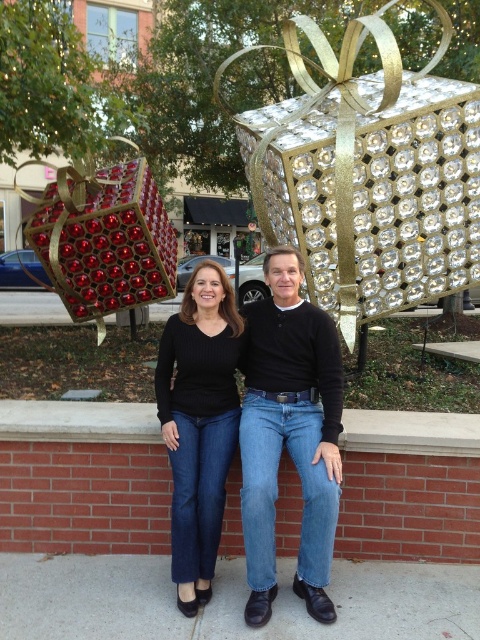
Question: Does shiny red baubles at left have a greater width compared to brick ledge at center?

Choices:
 (A) yes
 (B) no

Answer: (A)

Question: Considering the real-world distances, which object is closest to the black matte jeans at center?

Choices:
 (A) shiny red baubles at left
 (B) black knit sweater at center
 (C) brick ledge at center

Answer: (B)

Question: Which object is positioned closest to the black matte jeans at center?

Choices:
 (A) brick ledge at center
 (B) shiny red baubles at left

Answer: (A)

Question: Which is nearer to the black matte jeans at center?

Choices:
 (A) brick ledge at center
 (B) black knit sweater at center
 (C) shiny red baubles at left

Answer: (B)

Question: From the image, what is the correct spatial relationship of black knit sweater at center in relation to brick ledge at center?

Choices:
 (A) below
 (B) above

Answer: (B)

Question: Does black knit sweater at center appear under brick ledge at center?

Choices:
 (A) yes
 (B) no

Answer: (B)